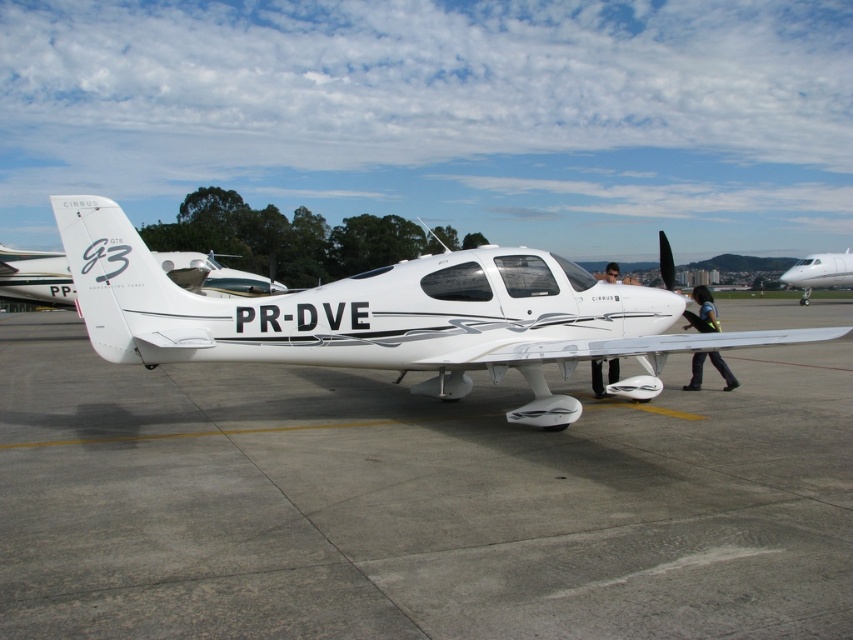
Looking at this image, which of these two, white glossy airplane at right or matte black helmet at center, stands shorter?

white glossy airplane at right

Can you confirm if white glossy airplane at right is positioned to the right of matte black helmet at center?

Yes, white glossy airplane at right is to the right of matte black helmet at center.

You are a GUI agent. You are given a task and a screenshot of the screen. Output one action in this format:
    pyautogui.click(x=<x>, y=<y>)
    Task: Click on the white glossy airplane at right
    This screenshot has width=853, height=640.
    Given the screenshot: What is the action you would take?
    pyautogui.click(x=819, y=273)

The width and height of the screenshot is (853, 640). Find the location of `white glossy airplane at right`. white glossy airplane at right is located at coordinates (819, 273).

Does white matte airplane at center lie behind matte black helmet at center?

No, it is not.

Which is more to the left, white matte airplane at center or matte black helmet at center?

white matte airplane at center

The image size is (853, 640). Describe the element at coordinates (387, 316) in the screenshot. I see `white matte airplane at center` at that location.

Identify the location of white matte airplane at center. This screenshot has width=853, height=640. (387, 316).

Identify the location of gray concrete tarmac at center. (416, 502).

How far apart are gray concrete tarmac at center and white glossy airplane at center?

gray concrete tarmac at center is 5.29 meters away from white glossy airplane at center.

Describe the element at coordinates (416, 502) in the screenshot. The width and height of the screenshot is (853, 640). I see `gray concrete tarmac at center` at that location.

Image resolution: width=853 pixels, height=640 pixels. Find the location of `gray concrete tarmac at center`. gray concrete tarmac at center is located at coordinates (416, 502).